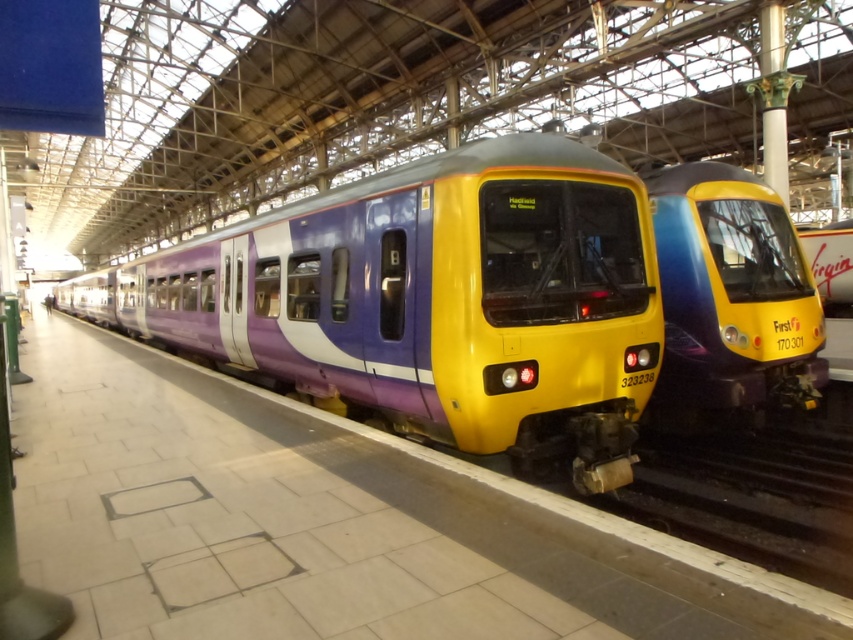
You are a maintenance worker who needs to cross between the purple glossy train at center and the yellow glossy train at center. The space between them is narrow. Can you safely walk through the gap without touching either train? Please explain your reasoning.

The gap between the purple glossy train at center and the yellow glossy train at center is 3.54 meters. Since an average person requires about 0.7 meters of space to walk comfortably, and the gap is significantly wider than that, you can safely walk through the gap without touching either train.

You are a passenger waiting at the train station. You need to board the larger train to reach your destination. Which train should you board, the purple glossy train at center or the yellow glossy train at center?

The purple glossy train at center is bigger than the yellow glossy train at center, so you should board the purple glossy train at center to reach your destination.